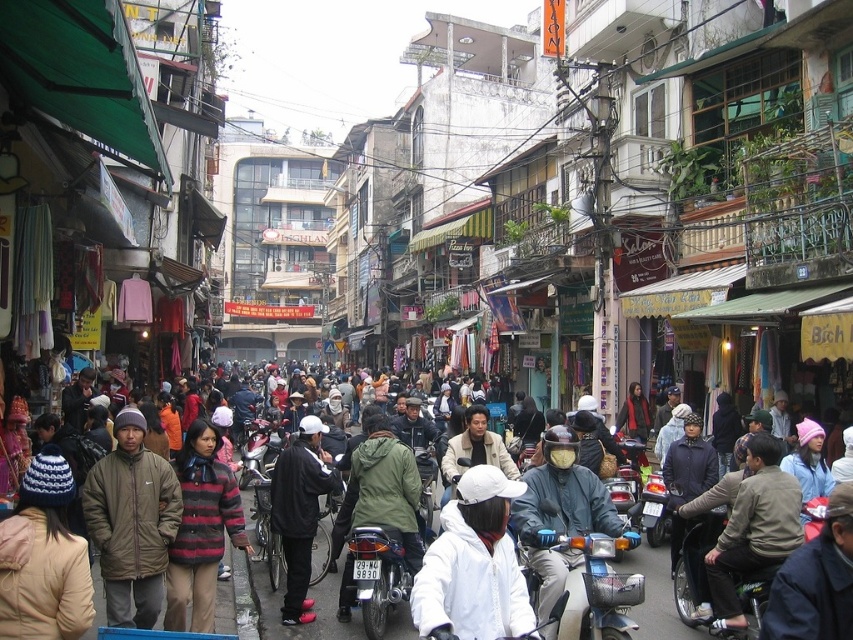
Is white knit hat at center smaller than metallic silver motorcycle at center?

Indeed, white knit hat at center has a smaller size compared to metallic silver motorcycle at center.

Who is taller, white knit hat at center or metallic silver motorcycle at center?

white knit hat at center

Is point (68, 534) closer to camera compared to point (270, 468)?

Yes, point (68, 534) is closer to viewer.

Identify the location of white knit hat at center. The image size is (853, 640). (44, 560).

Which is more to the right, white knit hat at center or striped woolen sweater at center?

striped woolen sweater at center is more to the right.

Identify the location of white knit hat at center. Image resolution: width=853 pixels, height=640 pixels. (44, 560).

Between striped woolen sweater at center and white knit hat at lower left, which one has less height?

Standing shorter between the two is striped woolen sweater at center.

At what (x,y) coordinates should I click in order to perform the action: click on striped woolen sweater at center. Please return your answer as a coordinate pair (x, y). Looking at the image, I should click on (201, 529).

This screenshot has height=640, width=853. I want to click on striped woolen sweater at center, so click(x=201, y=529).